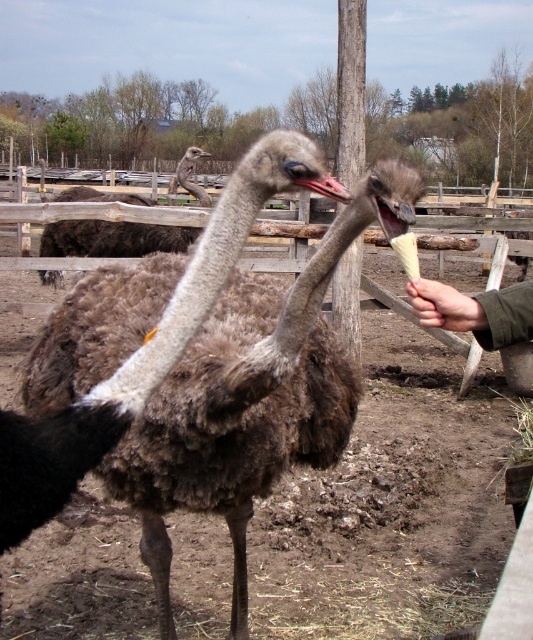
You are taking a photo of the ostriches and want to focus on the point closer to the camera. Which point should you choose between point (214, 461) and point (133, 246)?

Point (214, 461) is closer to the camera than point (133, 246), so you should choose point (214, 461) to focus on.

You are a zookeeper trying to feed two ostriches. You notice two hands holding food in the scene. The green fabric hand at right is holding a piece of lettuce, and the smooth skin hand at center has a carrot. Which hand is taller and might be easier for the ostrich to see?

The green fabric hand at right has a greater height compared to the smooth skin hand at center, so it might be easier for the ostrich to see.

You are a farmer who wants to feed the brown fuzzy ostrich at center without getting too close. The smooth skin hand at center is already holding food. How can you adjust your position to ensure the ostrich can reach the food without you needing to extend your hand further?

The brown fuzzy ostrich at center is wider than the smooth skin hand at center, so you can move your hand slightly to the side to allow the ostrich to reach the food while maintaining a safe distance.